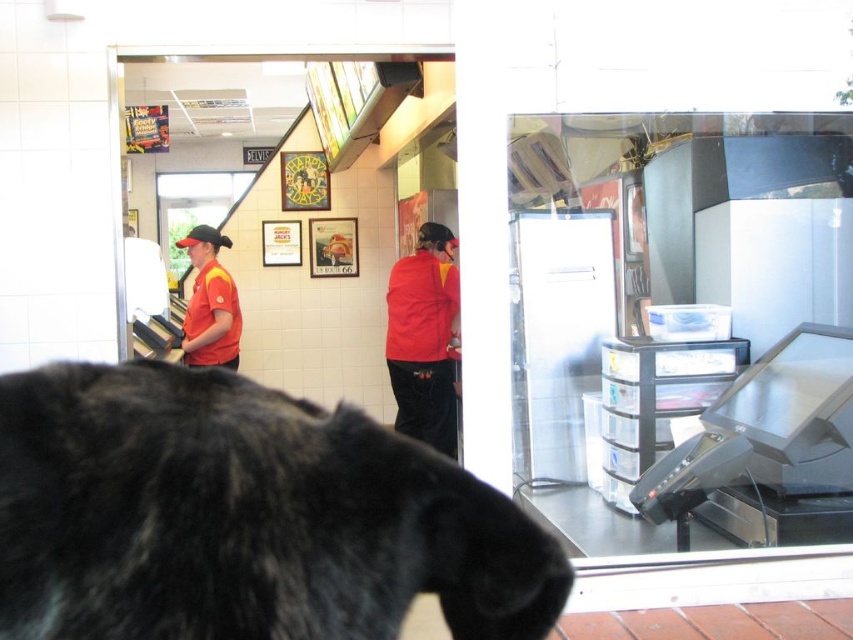
You are a delivery person who needs to locate the transparent plastic drawer at center in the fast food restaurant. Based on the coordinates provided, where would you find it?

The transparent plastic drawer at center is located at coordinates point (680, 312).